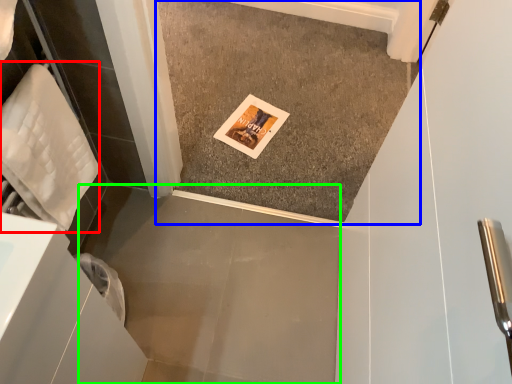
Question: Considering the real-world distances, which object is closest to material (highlighted by a red box)? concrete (highlighted by a blue box) or concrete (highlighted by a green box).

Choices:
 (A) concrete
 (B) concrete

Answer: (B)